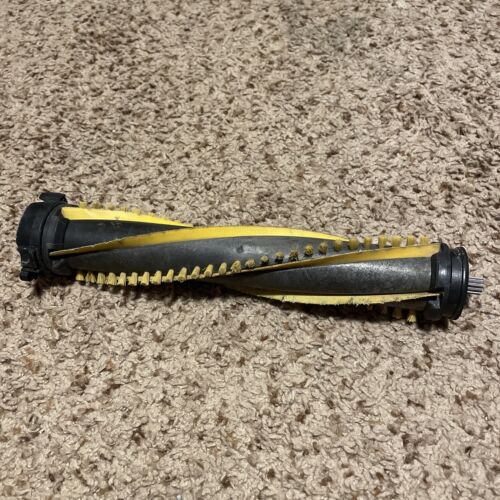
Locate an element on the screen. This screenshot has width=500, height=500. metal peg for mounting roller is located at coordinates (475, 285).